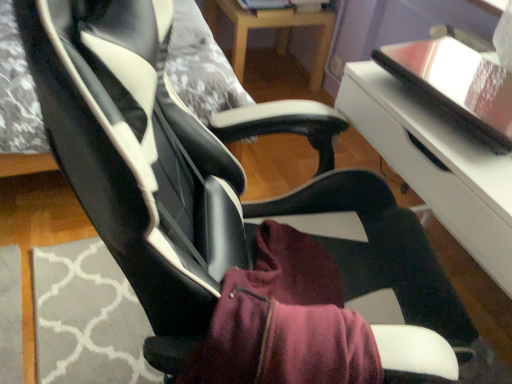
Image resolution: width=512 pixels, height=384 pixels. In order to click on wooden table at center, the 1th table in the top-to-bottom sequence in this screenshot , I will do pyautogui.click(x=276, y=32).

Describe the element at coordinates (276, 32) in the screenshot. I see `wooden table at center, which is counted as the 2th table, starting from the bottom` at that location.

Find the location of a particular element. The width and height of the screenshot is (512, 384). white glossy table at center, which appears as the second table when viewed from the top is located at coordinates (436, 163).

The width and height of the screenshot is (512, 384). Describe the element at coordinates (436, 163) in the screenshot. I see `white glossy table at center, marked as the first table in a bottom-to-top arrangement` at that location.

I want to click on wooden table at center, the 1th table in the top-to-bottom sequence, so click(x=276, y=32).

Which object is positioned more to the right, wooden table at center, the 1th table in the top-to-bottom sequence, or white glossy table at center, which appears as the second table when viewed from the top?

white glossy table at center, which appears as the second table when viewed from the top.

Which object is further away from the camera taking this photo, wooden table at center, placed as the 2th table when sorted from front to back, or white glossy table at center, marked as the first table in a bottom-to-top arrangement?

wooden table at center, placed as the 2th table when sorted from front to back, is further from the camera.

Does point (241, 71) appear closer or farther from the camera than point (435, 180)?

Point (241, 71) is farther from the camera than point (435, 180).

From the image's perspective, which is above, wooden table at center, the first table in the back-to-front sequence, or white glossy table at center, marked as the first table in a bottom-to-top arrangement?

wooden table at center, the first table in the back-to-front sequence.

From a real-world perspective, does wooden table at center, the 1th table in the top-to-bottom sequence, stand above white glossy table at center, marked as the first table in a bottom-to-top arrangement?

No, from a real-world perspective, wooden table at center, the 1th table in the top-to-bottom sequence, is not above white glossy table at center, marked as the first table in a bottom-to-top arrangement.

Which of these two, wooden table at center, the first table in the back-to-front sequence, or white glossy table at center, which appears as the second table when viewed from the top, is thinner?

With smaller width is wooden table at center, the first table in the back-to-front sequence.

Is wooden table at center, the first table in the back-to-front sequence, taller than white glossy table at center, acting as the first table starting from the front?

No.

Considering the sizes of wooden table at center, the first table in the back-to-front sequence, and white glossy table at center, which is counted as the 2th table, starting from the back, in the image, is wooden table at center, the first table in the back-to-front sequence, bigger or smaller than white glossy table at center, which is counted as the 2th table, starting from the back,?

Considering their sizes, wooden table at center, the first table in the back-to-front sequence, takes up less space than white glossy table at center, which is counted as the 2th table, starting from the back.

Is wooden table at center, placed as the 2th table when sorted from front to back, outside of white glossy table at center, acting as the first table starting from the front?

Indeed, wooden table at center, placed as the 2th table when sorted from front to back, is completely outside white glossy table at center, acting as the first table starting from the front.

Is wooden table at center, placed as the 2th table when sorted from front to back, in contact with white glossy table at center, acting as the first table starting from the front?

No, wooden table at center, placed as the 2th table when sorted from front to back, is not touching white glossy table at center, acting as the first table starting from the front.

Is wooden table at center, placed as the 2th table when sorted from front to back, aimed at white glossy table at center, acting as the first table starting from the front?

No, wooden table at center, placed as the 2th table when sorted from front to back, is not oriented towards white glossy table at center, acting as the first table starting from the front.

The height and width of the screenshot is (384, 512). Identify the location of table that is in front of the wooden table at center, placed as the 2th table when sorted from front to back. (436, 163).

Does white glossy table at center, marked as the first table in a bottom-to-top arrangement, appear on the right side of wooden table at center, the 1th table in the top-to-bottom sequence?

Yes.

Based on the photo, considering their positions, is white glossy table at center, which appears as the second table when viewed from the top, located in front of or behind wooden table at center, placed as the 2th table when sorted from front to back?

white glossy table at center, which appears as the second table when viewed from the top, is in front of wooden table at center, placed as the 2th table when sorted from front to back.

Does point (467, 206) appear closer or farther from the camera than point (315, 78)?

Point (467, 206) is closer to the camera than point (315, 78).

From the image's perspective, would you say white glossy table at center, acting as the first table starting from the front, is positioned over wooden table at center, the first table in the back-to-front sequence?

No, from the image's perspective, white glossy table at center, acting as the first table starting from the front, is not above wooden table at center, the first table in the back-to-front sequence.

From a real-world perspective, is white glossy table at center, which is counted as the 2th table, starting from the back, below wooden table at center, the first table in the back-to-front sequence?

Incorrect, from a real-world perspective, white glossy table at center, which is counted as the 2th table, starting from the back, is higher than wooden table at center, the first table in the back-to-front sequence.

Is white glossy table at center, marked as the first table in a bottom-to-top arrangement, wider or thinner than wooden table at center, placed as the 2th table when sorted from front to back?

white glossy table at center, marked as the first table in a bottom-to-top arrangement, is wider than wooden table at center, placed as the 2th table when sorted from front to back.

In terms of height, does white glossy table at center, which is counted as the 2th table, starting from the back, look taller or shorter compared to wooden table at center, which is counted as the 2th table, starting from the bottom?

Clearly, white glossy table at center, which is counted as the 2th table, starting from the back, is taller compared to wooden table at center, which is counted as the 2th table, starting from the bottom.

From the picture: Considering the sizes of objects white glossy table at center, acting as the first table starting from the front, and wooden table at center, placed as the 2th table when sorted from front to back, in the image provided, who is smaller, white glossy table at center, acting as the first table starting from the front, or wooden table at center, placed as the 2th table when sorted from front to back,?

wooden table at center, placed as the 2th table when sorted from front to back.

Is white glossy table at center, acting as the first table starting from the front, situated inside wooden table at center, the 1th table in the top-to-bottom sequence, or outside?

white glossy table at center, acting as the first table starting from the front, cannot be found inside wooden table at center, the 1th table in the top-to-bottom sequence.

Are white glossy table at center, which is counted as the 2th table, starting from the back, and wooden table at center, the 1th table in the top-to-bottom sequence, located far from each other?

Yes, white glossy table at center, which is counted as the 2th table, starting from the back, and wooden table at center, the 1th table in the top-to-bottom sequence, are quite far apart.

Is wooden table at center, placed as the 2th table when sorted from front to back, at the back of white glossy table at center, acting as the first table starting from the front?

No, white glossy table at center, acting as the first table starting from the front, is not facing the opposite direction of wooden table at center, placed as the 2th table when sorted from front to back.

How many degrees apart are the facing directions of white glossy table at center, which appears as the second table when viewed from the top, and wooden table at center, the 1th table in the top-to-bottom sequence?

The angular difference between white glossy table at center, which appears as the second table when viewed from the top, and wooden table at center, the 1th table in the top-to-bottom sequence, is 1.9 degrees.

Where is `table behind the white glossy table at center, marked as the first table in a bottom-to-top arrangement`? The width and height of the screenshot is (512, 384). table behind the white glossy table at center, marked as the first table in a bottom-to-top arrangement is located at coordinates (276, 32).

Locate an element on the screen. The width and height of the screenshot is (512, 384). table located on the right of wooden table at center, which is counted as the 2th table, starting from the bottom is located at coordinates (436, 163).

Locate an element on the screen. This screenshot has width=512, height=384. table in front of the wooden table at center, which is counted as the 2th table, starting from the bottom is located at coordinates (436, 163).